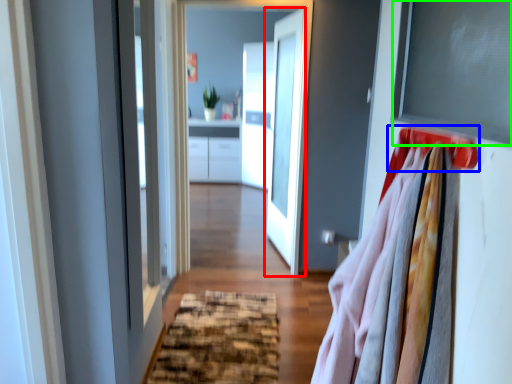
Question: Based on their relative distances, which object is farther from door (highlighted by a red box)? Choose from hanger (highlighted by a blue box) and window screen (highlighted by a green box).

Choices:
 (A) hanger
 (B) window screen

Answer: (A)